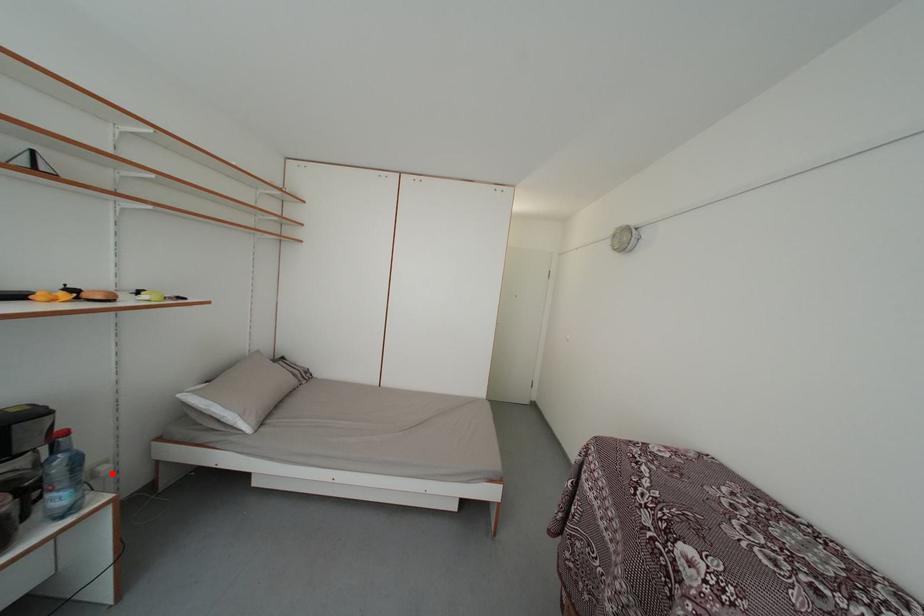
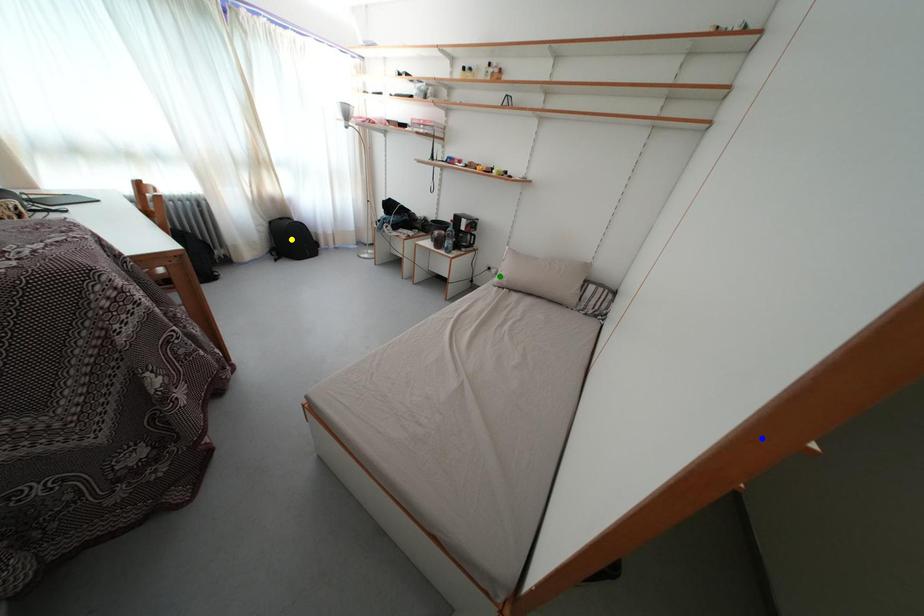
Question: I am providing you with two images of the same scene from different viewpoints. A red point is marked on the first image. You are given multiple points on the second image. In image 2, which mark is for the same physical point as the one in image 1?

Choices:
 (A) blue point
 (B) green point
 (C) yellow point

Answer: (B)